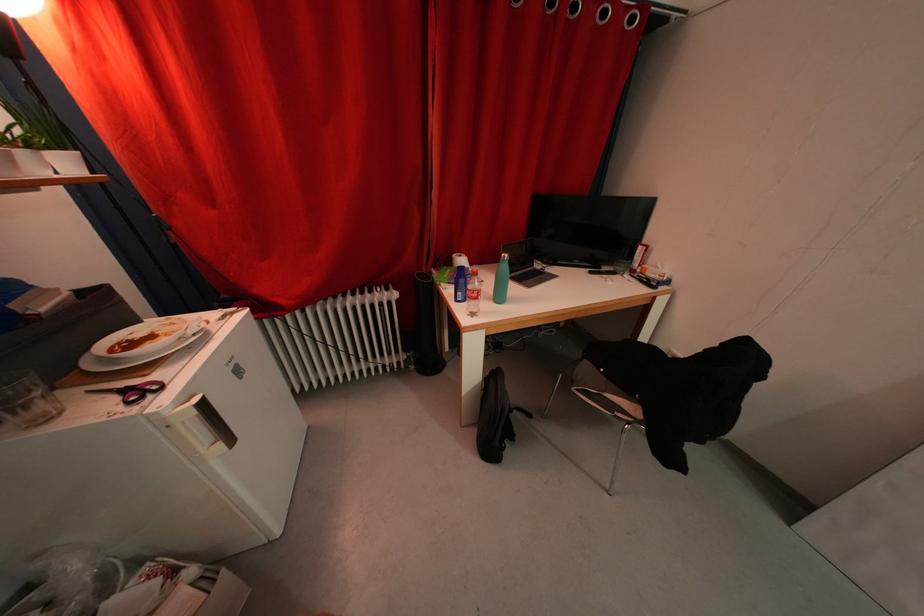
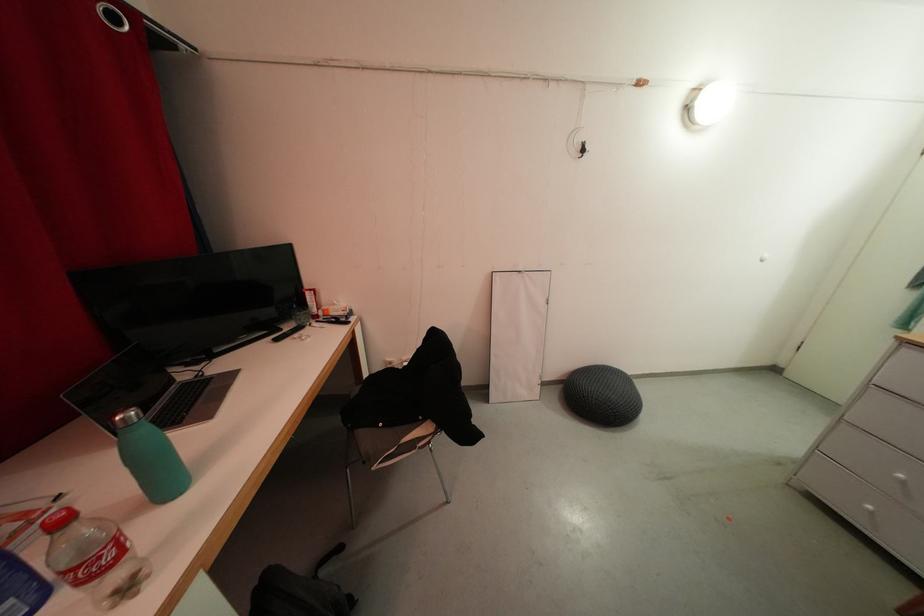
Where in the second image is the point corresponding to (478,318) from the first image?

(134, 593)